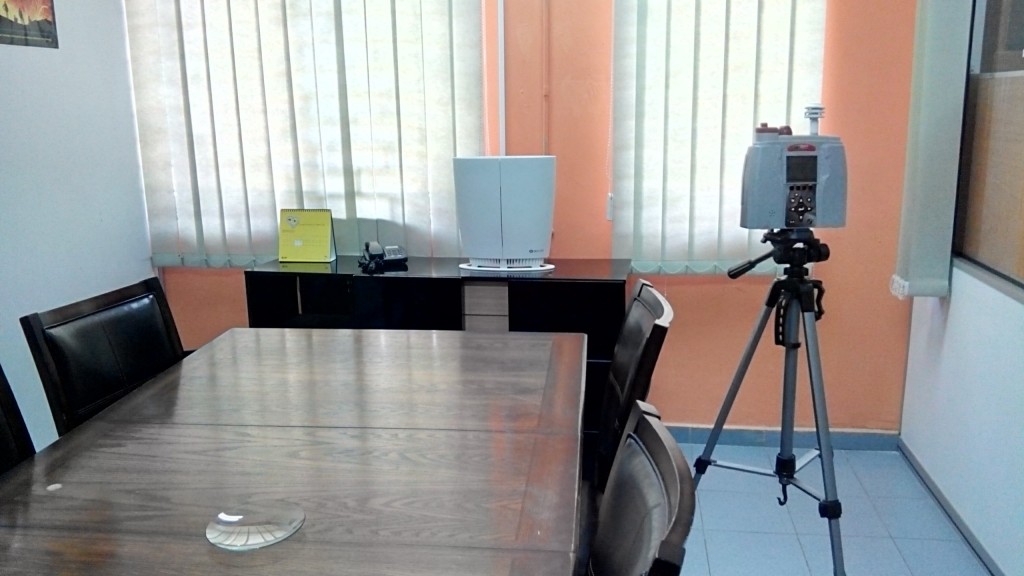
The image size is (1024, 576). Identify the location of telephone on top of credenza. (385, 261).